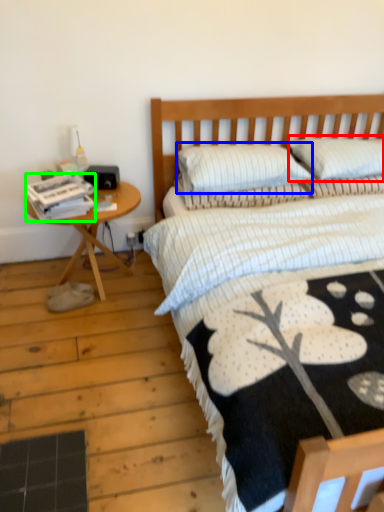
Question: Based on their relative distances, which object is farther from pillow (highlighted by a red box)? Choose from pillow (highlighted by a blue box) and magazine (highlighted by a green box).

Choices:
 (A) pillow
 (B) magazine

Answer: (B)